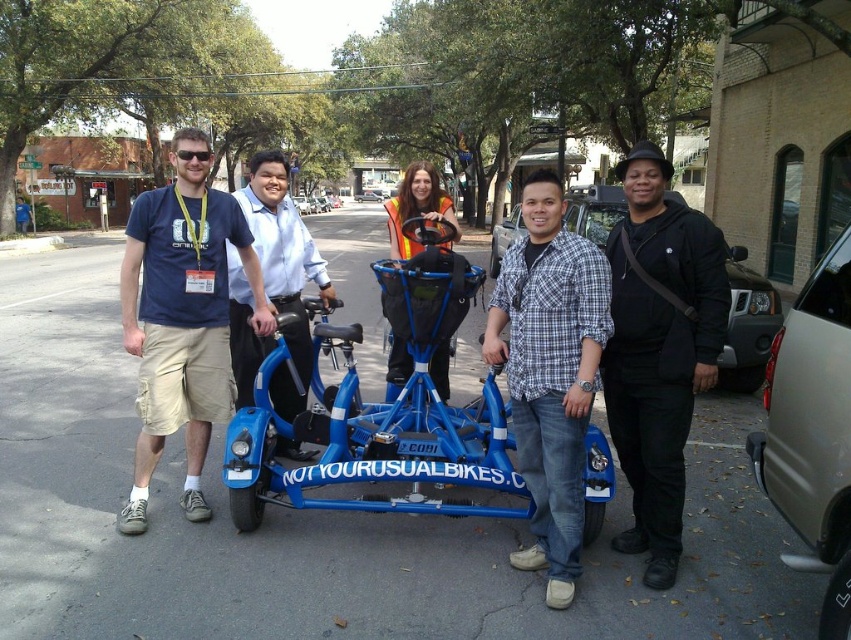
You are standing at the origin point of the coordinate system in the image. The black matte jacket at center is at point 0.547, 0.776. Can you determine if the jacket is closer to the top or bottom of the image?

The black matte jacket at center is located at point (660, 349). Since the y coordinate is 0.776, which is closer to 1.0, the jacket is closer to the bottom of the image.

You are a photographer trying to capture a closeup of the black matte jacket at center. Based on the coordinates provided, which object in the scene is located exactly at point (660, 349)?

The point (660, 349) indicates the location of the black matte jacket at center.

You are a delivery person with a cart that is 1.5 meters wide. You need to move from the blue matte tricycle at center to the metallic gray sedan at lower right. Is there enough space between them for your cart to pass through?

The distance between the blue matte tricycle at center and the metallic gray sedan at lower right is 2.07 meters. Since your cart is 1.5 meters wide, there is sufficient space for it to pass through as 2.07 meters is greater than 1.5 meters.